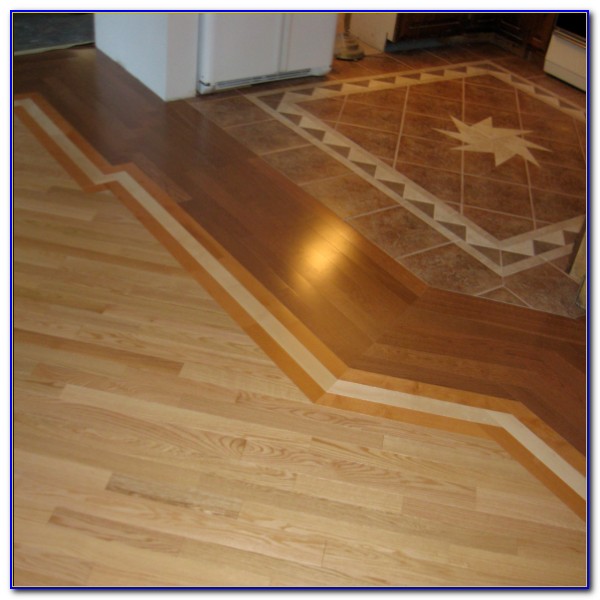
Where is `bottom of oven`? bottom of oven is located at coordinates (390, 30).